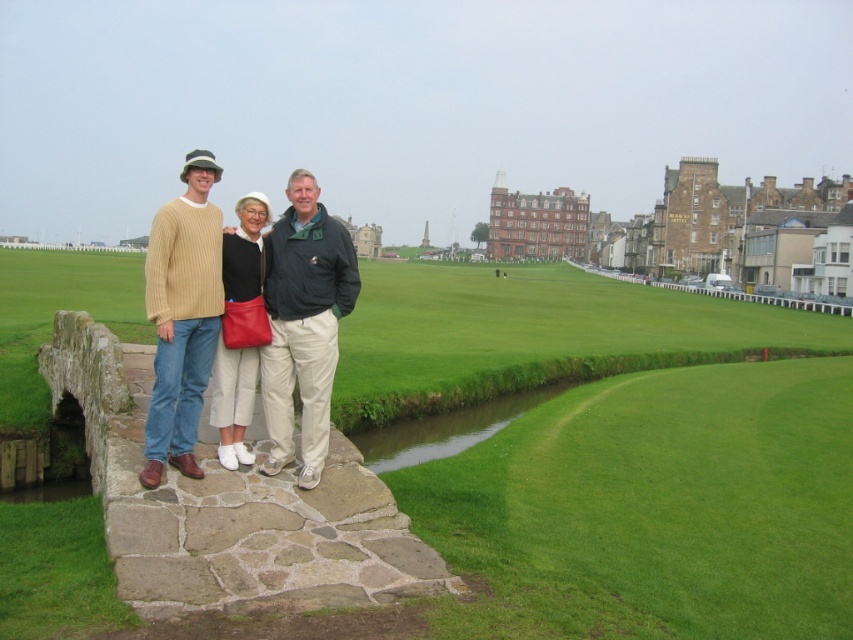
Question: Can you confirm if dark green textured jacket at center is positioned below knit sweater at left?

Choices:
 (A) no
 (B) yes

Answer: (A)

Question: Which object is the farthest from the dark green textured jacket at center?

Choices:
 (A) matte black jacket at center
 (B) knit sweater at left

Answer: (B)

Question: Is green grass at center to the right of knit sweater at left from the viewer's perspective?

Choices:
 (A) no
 (B) yes

Answer: (B)

Question: Which point is farther to the camera?

Choices:
 (A) dark green textured jacket at center
 (B) knit sweater at left
 (C) matte beige sweater at center

Answer: (A)

Question: Which object is positioned closest to the matte black jacket at center?

Choices:
 (A) green grass at center
 (B) knit sweater at left

Answer: (B)

Question: Does green grass at center come in front of knit sweater at left?

Choices:
 (A) no
 (B) yes

Answer: (B)